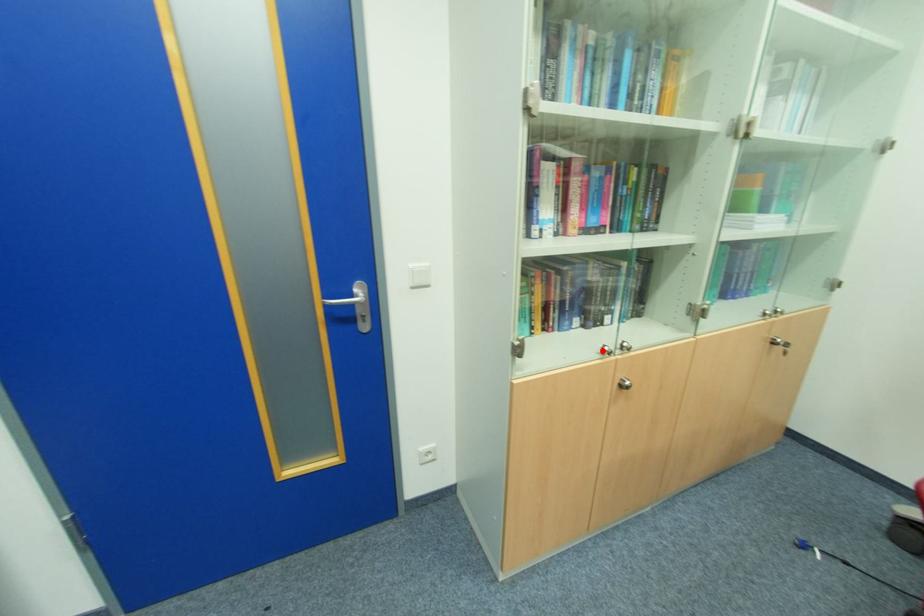
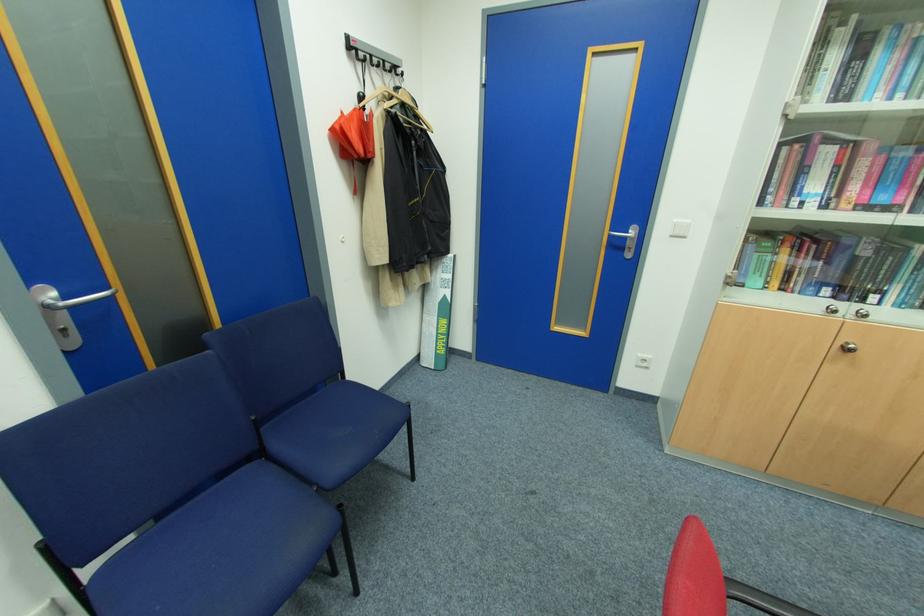
The point at the highlighted location is marked in the first image. Where is the corresponding point in the second image?

(830, 310)